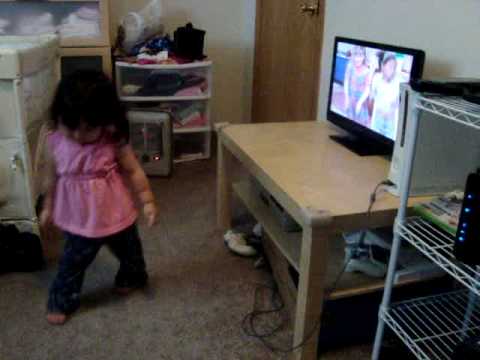
At what (x,y) coordinates should I click in order to perform the action: click on doorknob. Please return your answer as a coordinate pair (x, y). Looking at the image, I should click on (306, 9).